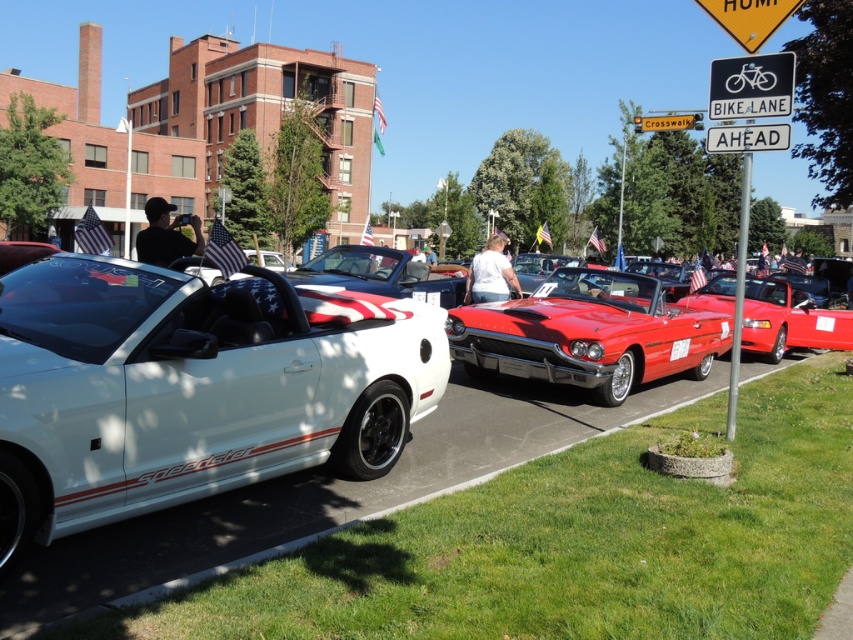
Which is below, white matte convertible at left or black plastic bike lane sign at upper center?

Positioned lower is white matte convertible at left.

Can you confirm if white matte convertible at left is wider than black plastic bike lane sign at upper center?

Incorrect, white matte convertible at left's width does not surpass black plastic bike lane sign at upper center's.

What are the coordinates of `white matte convertible at left` in the screenshot? It's located at click(x=192, y=388).

Is shiny red convertible at center shorter than red matte license plate at center?

Incorrect, shiny red convertible at center's height does not fall short of red matte license plate at center's.

Is point (585, 321) in front of point (672, 356)?

Yes, it is in front of point (672, 356).

The height and width of the screenshot is (640, 853). I want to click on shiny red convertible at center, so click(x=587, y=333).

Is black plastic bike lane sign at upper center positioned behind red matte license plate at center?

No, black plastic bike lane sign at upper center is in front of red matte license plate at center.

Is black plastic bike lane sign at upper center positioned before red matte license plate at center?

Yes, it is in front of red matte license plate at center.

Who is more distant from viewer, (732, 115) or (685, 340)?

Point (685, 340)

The height and width of the screenshot is (640, 853). I want to click on black plastic bike lane sign at upper center, so click(x=751, y=86).